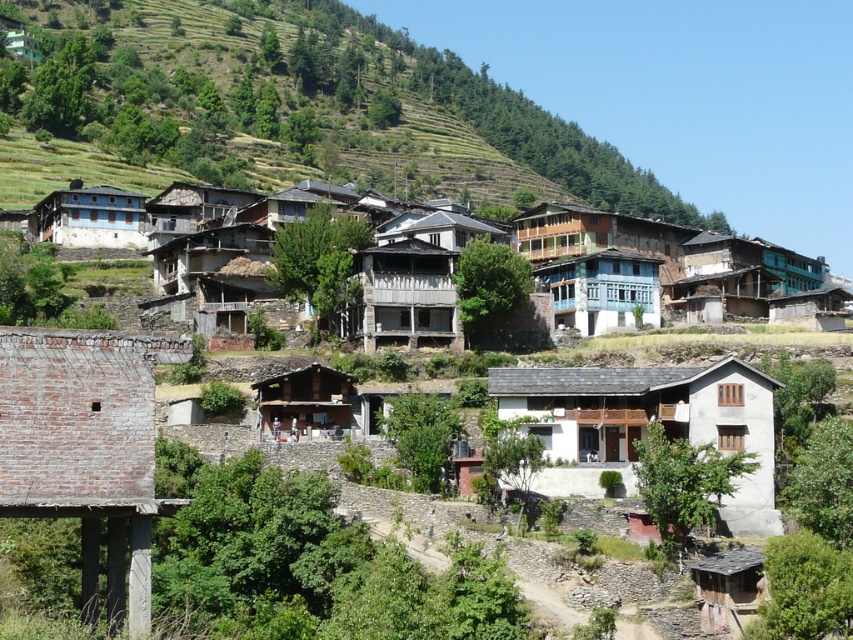
You are standing in the hillside village and want to take a photo. You notice two points of interest marked as point 1 and point 2. Point 1 is located at coordinates point (48, 17) and point 2 is at point (370, 280). Which point is closer to you, the photographer, so that you can focus your camera properly?

Point 1 is closer to you because it is further to the camera than point 2.